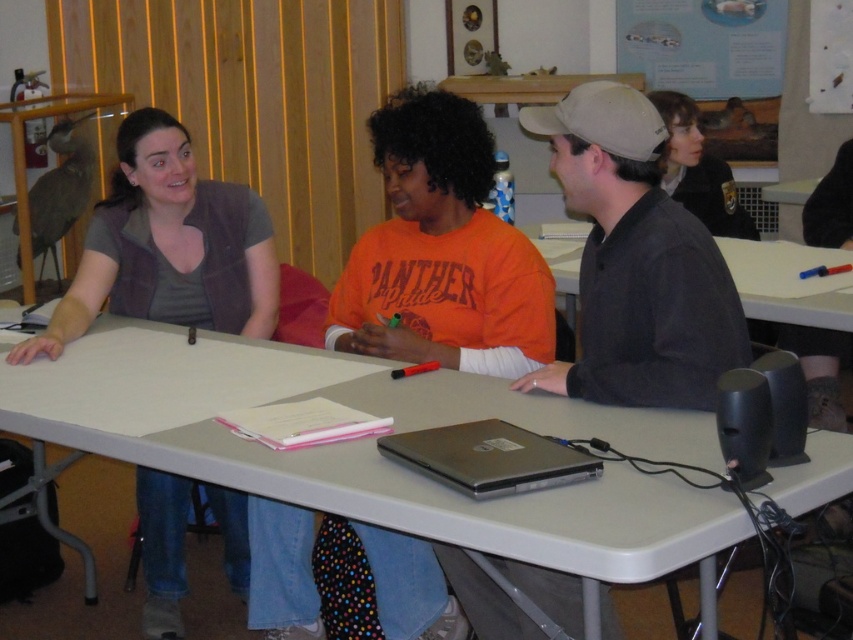
Measure the distance between matte gray vest at left and matte black jacket at upper right.

matte gray vest at left is 1.86 meters from matte black jacket at upper right.

Between point (271, 280) and point (659, 108), which one is positioned in front?

Point (271, 280)

Does point (178, 307) come farther from viewer compared to point (705, 209)?

No, (178, 307) is closer to viewer.

This screenshot has height=640, width=853. In order to click on matte gray vest at left in this screenshot , I will do `click(167, 246)`.

Is silver metallic laptop at center below white plastic table at center?

Correct, silver metallic laptop at center is located below white plastic table at center.

Consider the image. Between silver metallic laptop at center and white plastic table at center, which one appears on the right side from the viewer's perspective?

white plastic table at center is more to the right.

What do you see at coordinates (489, 458) in the screenshot?
I see `silver metallic laptop at center` at bounding box center [489, 458].

This screenshot has height=640, width=853. Identify the location of silver metallic laptop at center. (489, 458).

Can you confirm if dark gray shirt at center is shorter than silver metallic laptop at center?

Incorrect, dark gray shirt at center's height does not fall short of silver metallic laptop at center's.

Find the location of `dark gray shirt at center`. dark gray shirt at center is located at coordinates (635, 262).

You are a GUI agent. You are given a task and a screenshot of the screen. Output one action in this format:
    pyautogui.click(x=<x>, y=<y>)
    Task: Click on the dark gray shirt at center
    The image size is (853, 640).
    Given the screenshot: What is the action you would take?
    pyautogui.click(x=635, y=262)